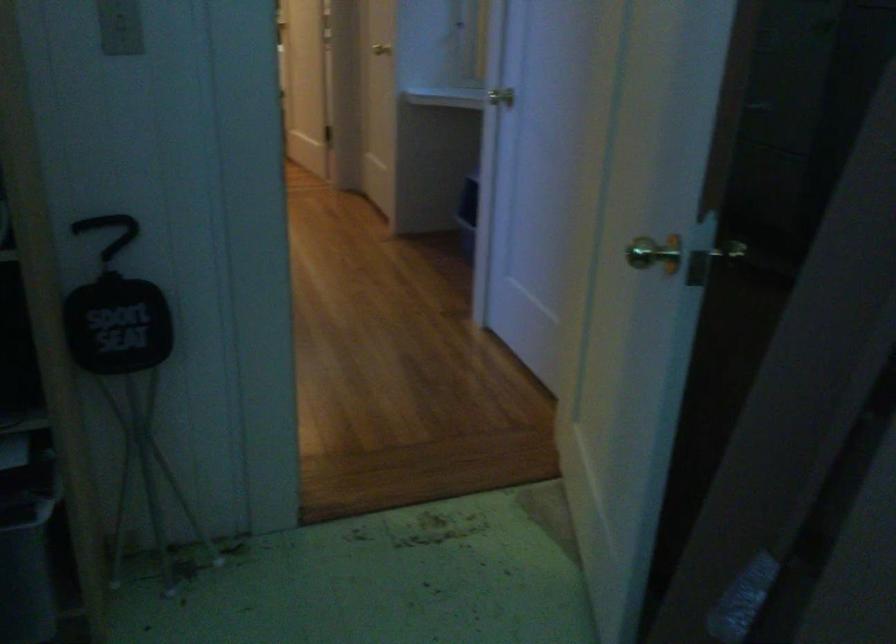
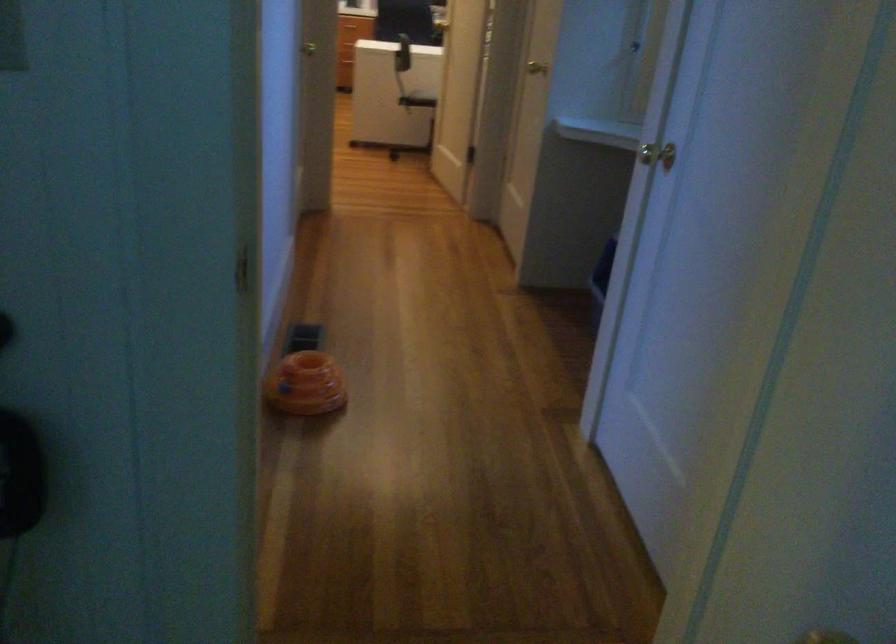
Question: What movement of the cameraman would produce the second image?

Choices:
 (A) Left
 (B) Right
 (C) Forward
 (D) Backward

Answer: (C)